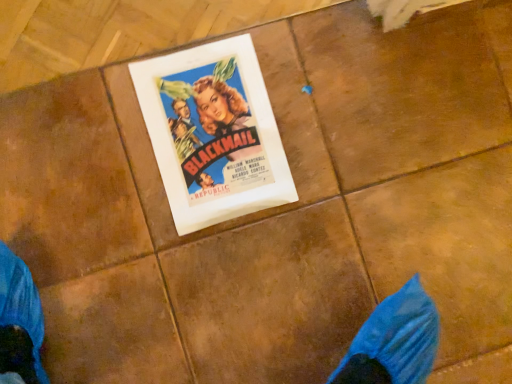
Find the location of a particular element. vacant space situated above matte paper poster at center (from a real-world perspective) is located at coordinates (216, 128).